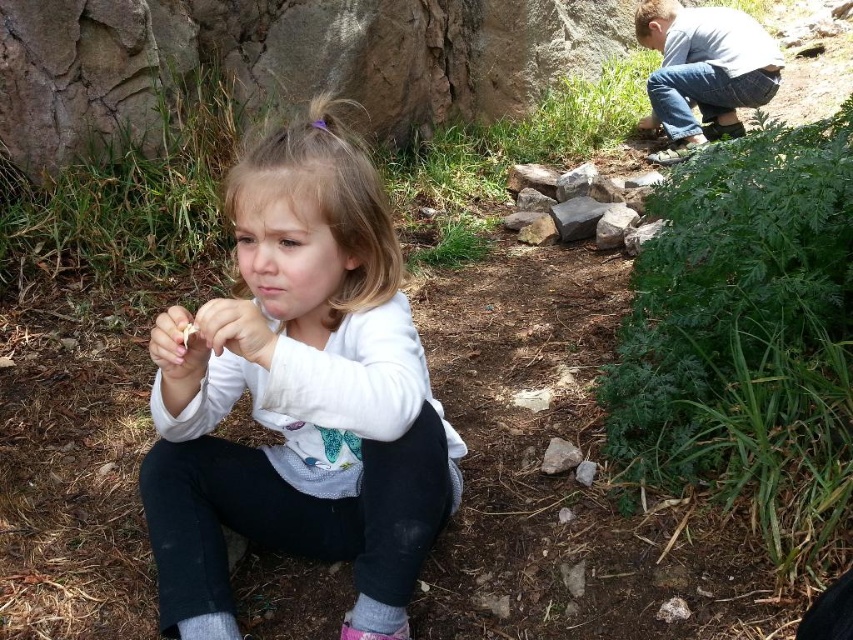
Which of these two, white matte shirt at center or gray rough rock at center, stands shorter?

gray rough rock at center

Is white matte shirt at center positioned behind gray rough rock at center?

No.

Where is `white matte shirt at center`? white matte shirt at center is located at coordinates click(x=299, y=388).

Which of these two, gray woolen sock at lower left or pink matte lips at center, stands taller?

With more height is pink matte lips at center.

Who is positioned more to the left, gray woolen sock at lower left or pink matte lips at center?

gray woolen sock at lower left

Locate an element on the screen. Image resolution: width=853 pixels, height=640 pixels. gray woolen sock at lower left is located at coordinates (209, 627).

Is gray rock at center smaller than gray cotton sock at lower center?

No.

Which is more to the right, gray rock at center or gray cotton sock at lower center?

From the viewer's perspective, gray rock at center appears more on the right side.

Is point (531, 193) positioned in front of point (350, 611)?

No.

The image size is (853, 640). Identify the location of gray rock at center. (589, 204).